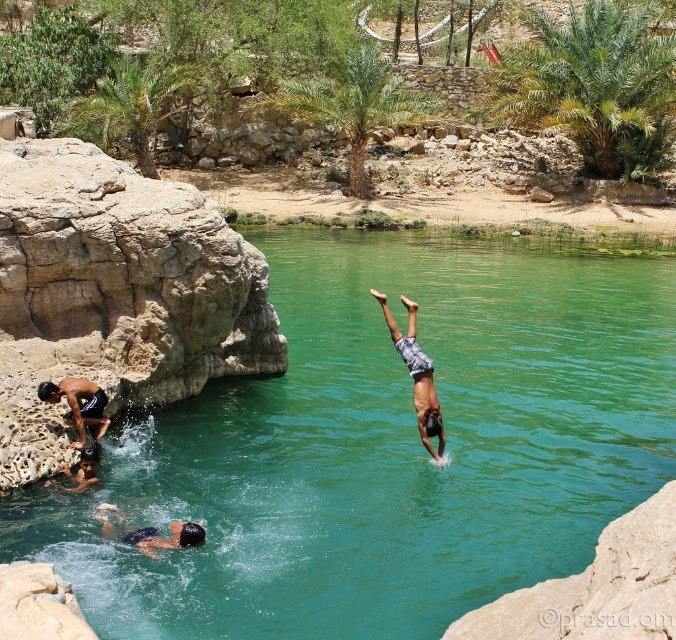
You are a photographer taking a picture of the plaid shorts at center and the dark blue swimwear at lower left. Which object will appear closer to the camera in the photo?

The plaid shorts at center will appear closer to the camera because the dark blue swimwear at lower left is behind it.

You are standing at the edge of the natural pool and want to jump into the green smooth water at center. The coordinates of the point where you want to land are given as point (383, 445). Is this point within the pool?

Yes, the point (383, 445) marks the green smooth water at center, which is within the pool.

You are a photographer trying to capture the plaid shorts at center and the dark blue swimwear at lower left in the same frame. Which one should you adjust your camera to focus on first if you want to include both in your shot?

You should focus on the plaid shorts at center first because it is positioned on the right side of dark blue swimwear at lower left, so adjusting the camera to include the rightmost object first ensures both are in frame.